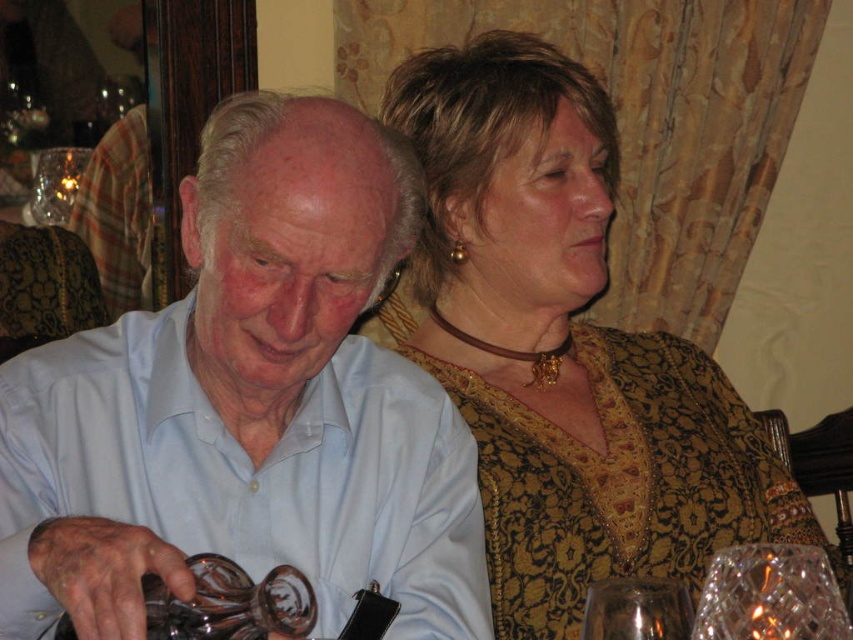
Question: Is gold textured dress at upper right positioned behind crystal clear glass at lower right?

Choices:
 (A) yes
 (B) no

Answer: (A)

Question: Is gold textured dress at upper right further to the viewer compared to clear glass bottle at lower left?

Choices:
 (A) yes
 (B) no

Answer: (A)

Question: Among these objects, which one is farthest from the camera?

Choices:
 (A) clear glass bottle at lower left
 (B) crystal clear glass at lower right
 (C) gold textured dress at upper right

Answer: (C)

Question: Is clear glass bottle at lower left closer to the viewer compared to transparent glass at lower right?

Choices:
 (A) yes
 (B) no

Answer: (B)

Question: Which of the following is the farthest from the observer?

Choices:
 (A) gold textured dress at upper right
 (B) transparent glass at lower right

Answer: (A)

Question: Which of these objects is positioned farthest from the transparent glass at lower right?

Choices:
 (A) clear glass bottle at lower left
 (B) crystal clear glass at lower right

Answer: (A)